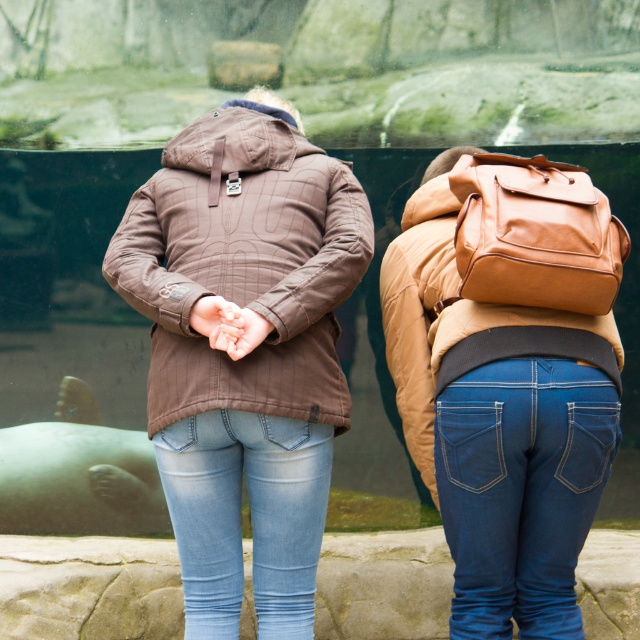
This screenshot has width=640, height=640. Find the location of `brown quilted jacket at center`. brown quilted jacket at center is located at coordinates (244, 266).

Can you confirm if brown quilted jacket at center is taller than denim jeans at center?

Yes, brown quilted jacket at center is taller than denim jeans at center.

Measure the distance between brown quilted jacket at center and camera.

brown quilted jacket at center is 4.37 meters from camera.

Identify the location of brown quilted jacket at center. The image size is (640, 640). (244, 266).

Does denim jeans at center appear on the left side of light blue denim jeans at center?

Incorrect, denim jeans at center is not on the left side of light blue denim jeans at center.

Between denim jeans at center and light blue denim jeans at center, which one is positioned higher?

denim jeans at center

Based on the photo, who is more forward, (566, 557) or (259, 600)?

Point (566, 557) is in front.

Image resolution: width=640 pixels, height=640 pixels. In order to click on denim jeans at center in this screenshot , I will do [522, 490].

Can you confirm if light blue denim jeans at center is positioned to the right of brown leather jacket at upper right?

In fact, light blue denim jeans at center is to the left of brown leather jacket at upper right.

Does light blue denim jeans at center have a greater height compared to brown leather jacket at upper right?

Incorrect, light blue denim jeans at center's height is not larger of brown leather jacket at upper right's.

I want to click on light blue denim jeans at center, so click(252, 516).